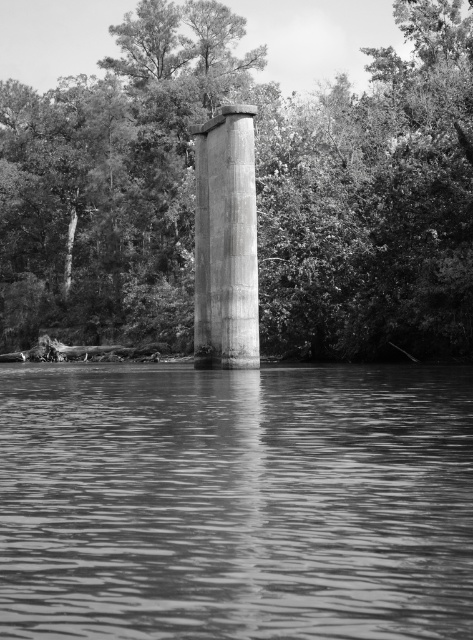
Can you confirm if smooth green tree at center is positioned above concrete column at center?

Yes, smooth green tree at center is above concrete column at center.

Who is more distant from viewer, (103, 205) or (224, 205)?

The point (103, 205) is behind.

Which is in front, point (106, 285) or point (236, 188)?

Point (236, 188) is in front.

This screenshot has width=473, height=640. Identify the location of smooth green tree at center. (255, 189).

Does smooth water at center have a larger size compared to concrete column at center?

No, smooth water at center is not bigger than concrete column at center.

Is smooth water at center above concrete column at center?

No.

You are a GUI agent. You are given a task and a screenshot of the screen. Output one action in this format:
    pyautogui.click(x=<x>, y=<y>)
    Task: Click on the smooth water at center
    
    Given the screenshot: What is the action you would take?
    pyautogui.click(x=236, y=502)

Does smooth green tree at center appear on the left side of smooth water at center?

Indeed, smooth green tree at center is positioned on the left side of smooth water at center.

This screenshot has height=640, width=473. Identify the location of smooth green tree at center. (255, 189).